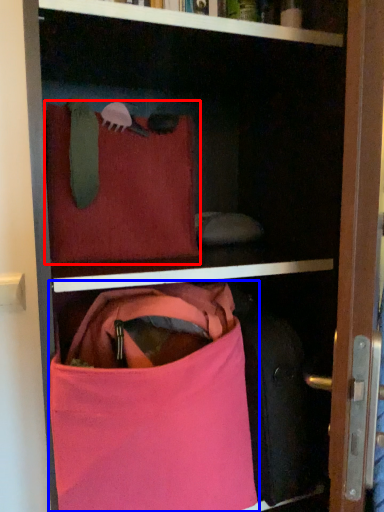
Question: Which object appears farthest to the camera in this image, pillow (highlighted by a red box) or handbag (highlighted by a blue box)?

Choices:
 (A) pillow
 (B) handbag

Answer: (A)